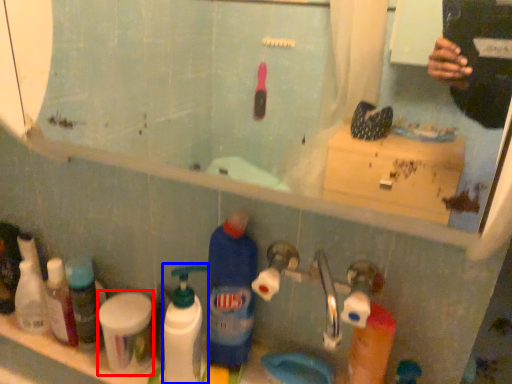
Question: Which object appears farthest to the camera in this image, mouthwash (highlighted by a red box) or cleaning product (highlighted by a blue box)?

Choices:
 (A) mouthwash
 (B) cleaning product

Answer: (A)